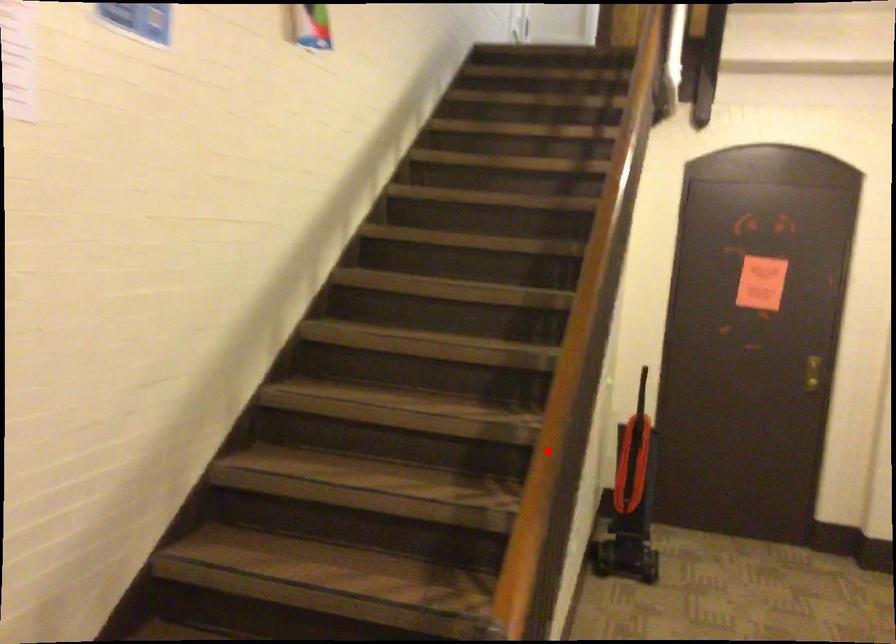
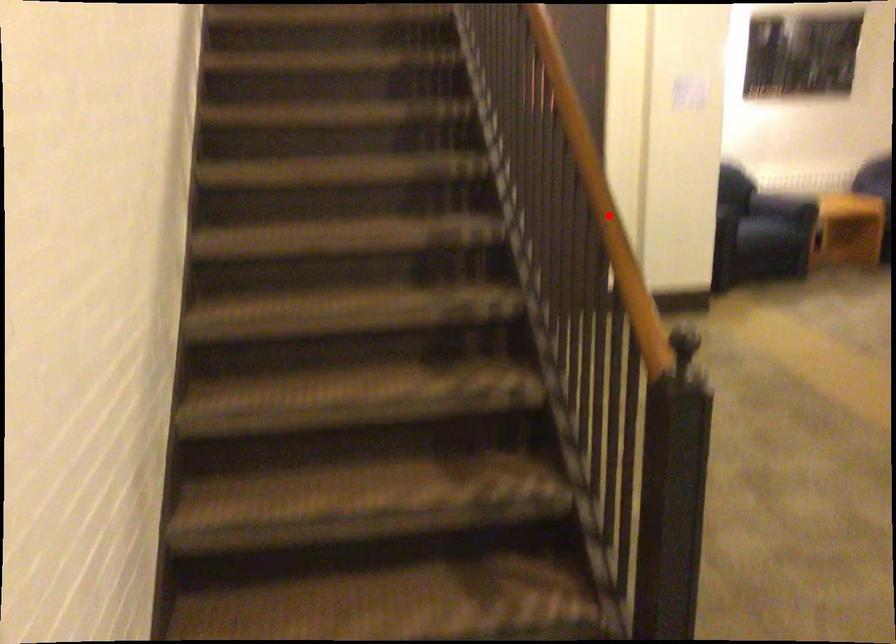
I am providing you with two images of the same scene from different viewpoints. A red point is marked on the first image and another point is marked on the second image. Does the point marked in image1 correspond to the same location as the one in image2?

Yes